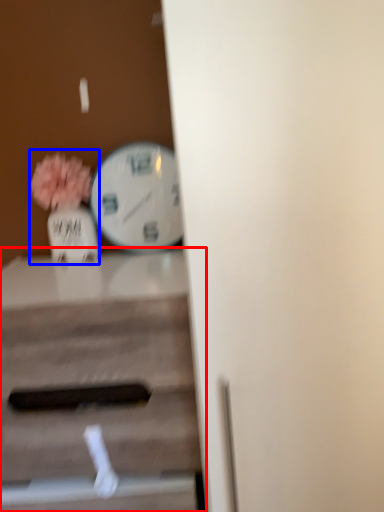
Question: Which object is further to the camera taking this photo, table (highlighted by a red box) or floral arrangement (highlighted by a blue box)?

Choices:
 (A) table
 (B) floral arrangement

Answer: (B)